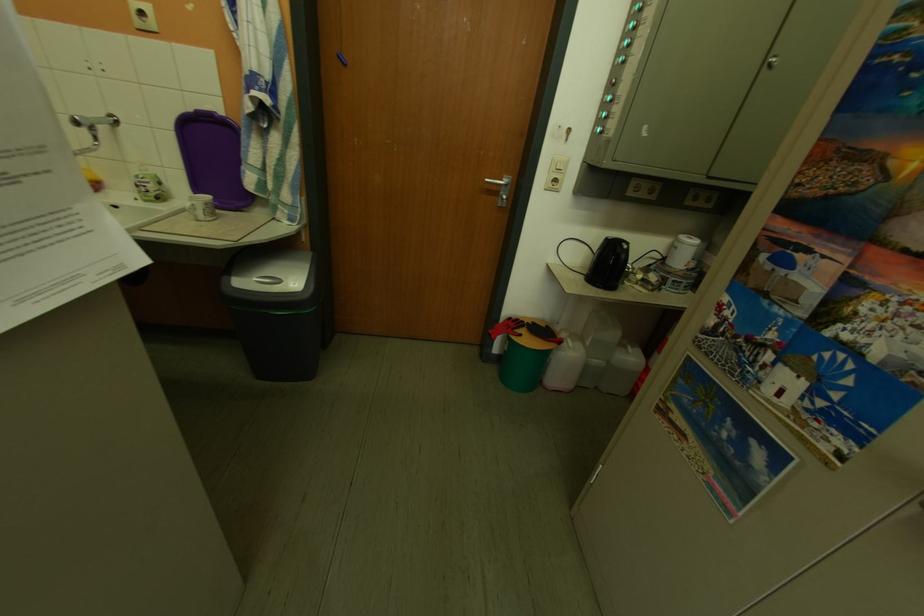
Identify the location of soap dispenser pump. (149, 185).